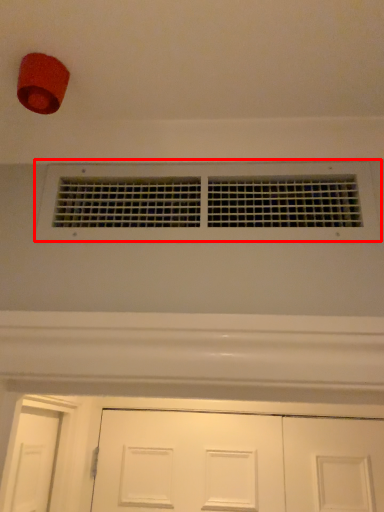
Question: From the image's perspective, what is the correct spatial positioning of window (annotated by the red box) in reference to door?

Choices:
 (A) below
 (B) above

Answer: (B)